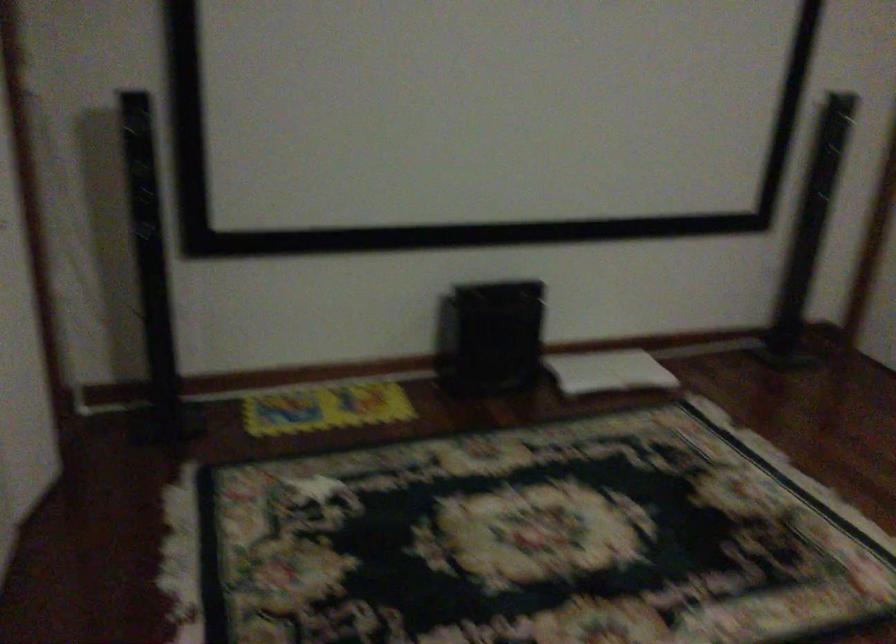
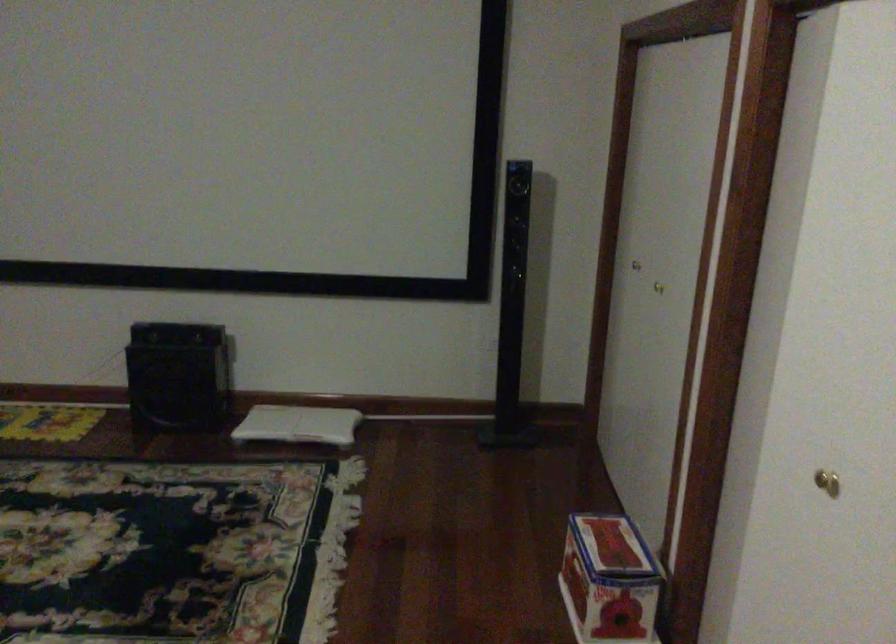
Question: In a continuous first-person perspective shot, in which direction is the camera moving?

Choices:
 (A) Left
 (B) Right
 (C) Forward
 (D) Backward

Answer: (B)